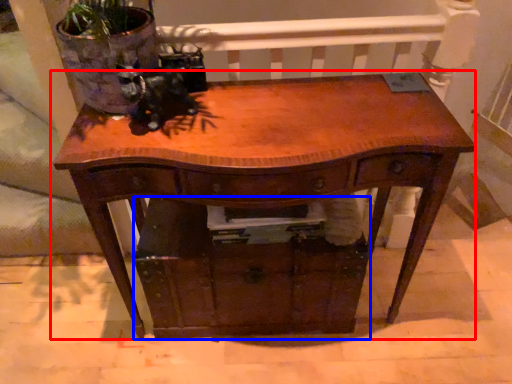
Question: Which point is further to the camera, table (highlighted by a red box) or drawer (highlighted by a blue box)?

Choices:
 (A) table
 (B) drawer

Answer: (B)